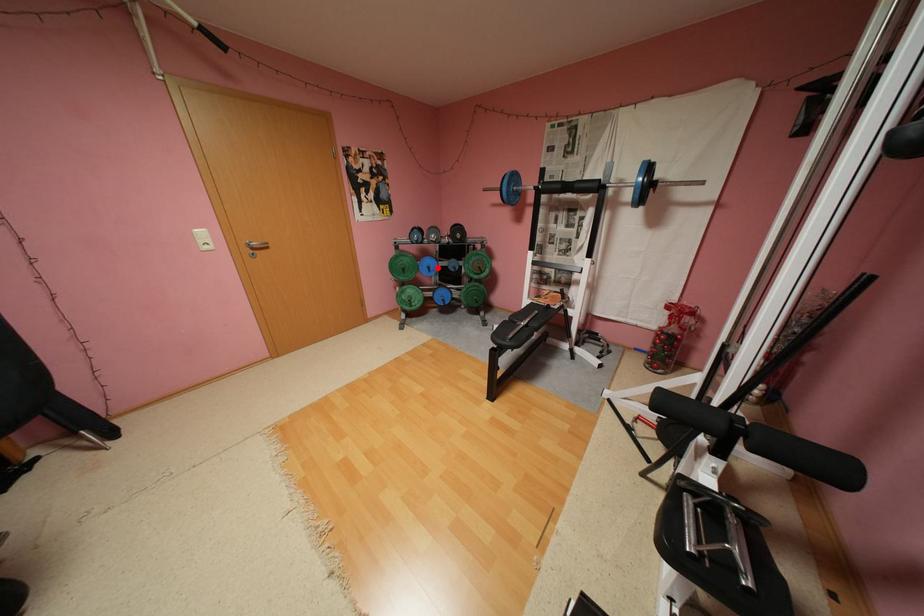
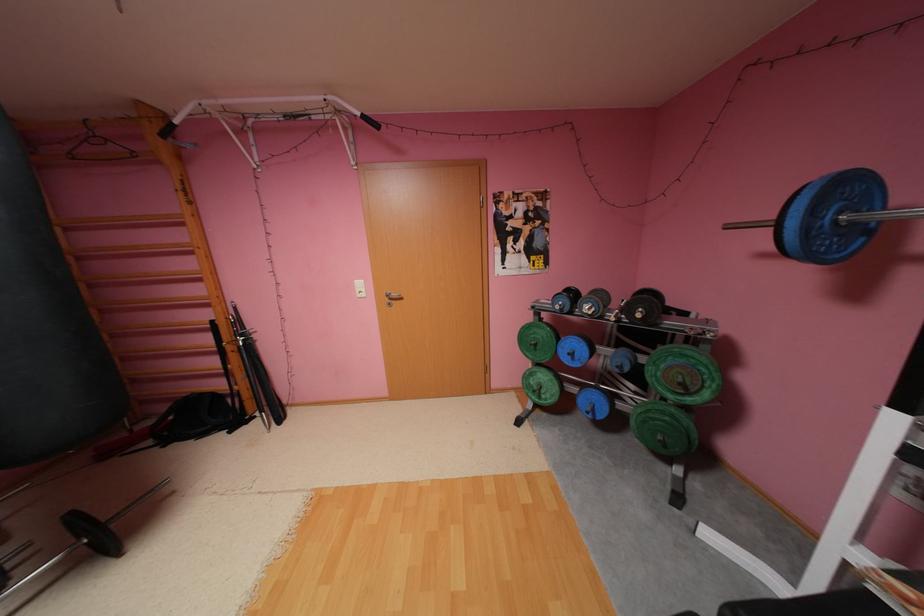
Question: I am providing you with two images of the same scene from different viewpoints. A red point is shown in image1. For the corresponding object point in image2, is it positioned nearer or farther from the camera?

Choices:
 (A) Nearer
 (B) Farther

Answer: (B)